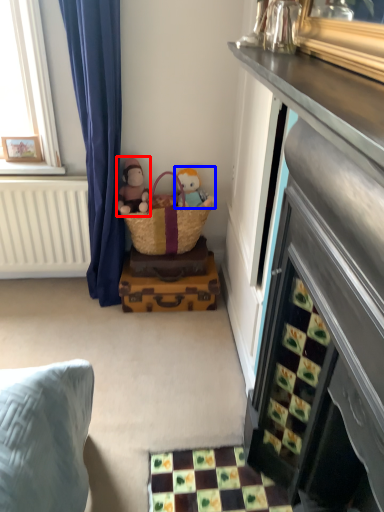
Question: Which of the following is the farthest to the observer, doll (highlighted by a red box) or toy (highlighted by a blue box)?

Choices:
 (A) doll
 (B) toy

Answer: (B)